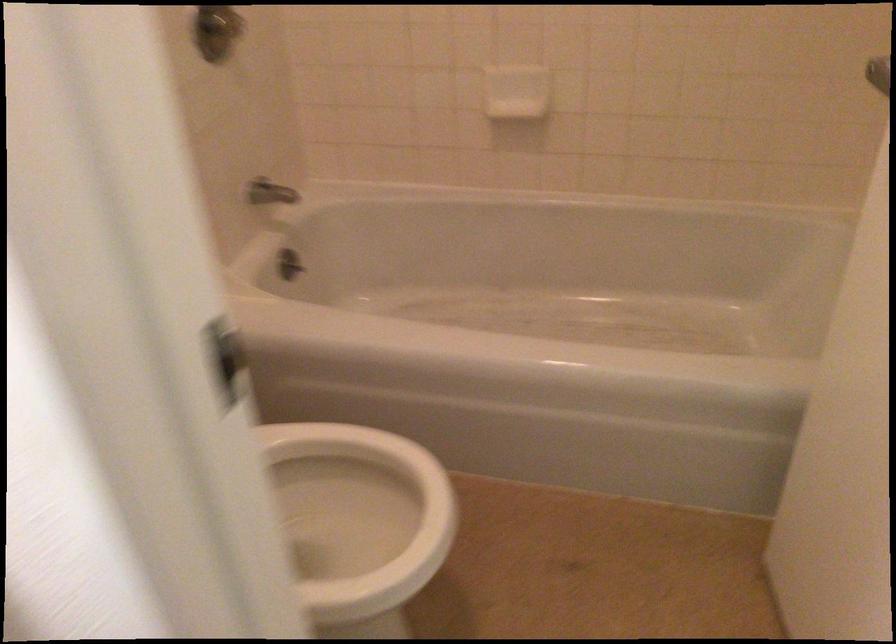
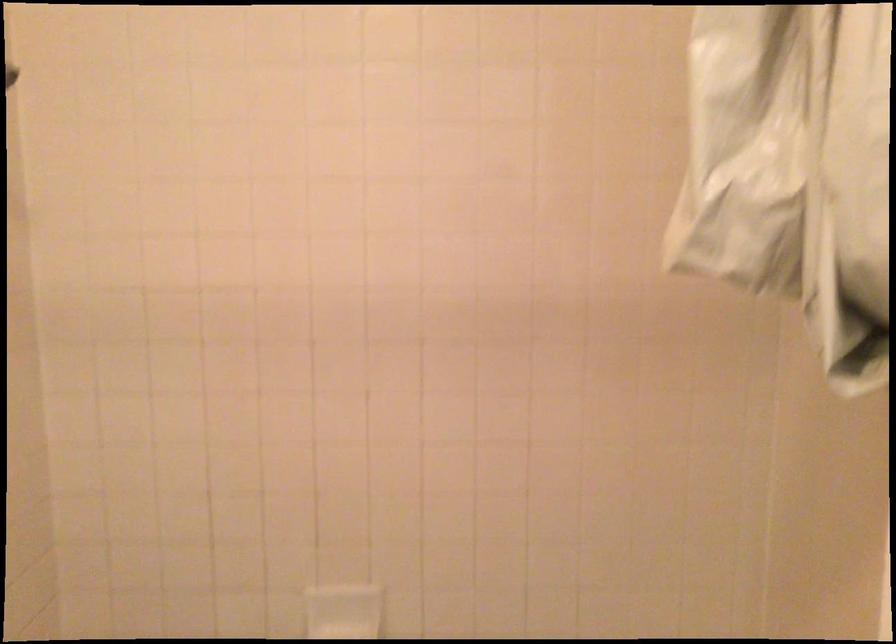
The first image is from the beginning of the video and the second image is from the end. How did the camera likely rotate when shooting the video?

The camera rotated toward right-up.